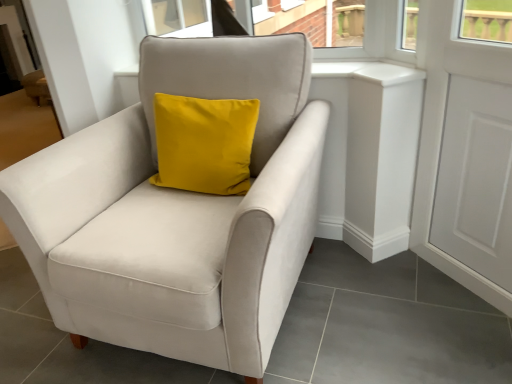
Question: From the image's perspective, is suede-like beige armchair at center located above or below white matte door at right?

Choices:
 (A) below
 (B) above

Answer: (A)

Question: Is point (212, 211) positioned closer to the camera than point (444, 190)?

Choices:
 (A) closer
 (B) farther

Answer: (A)

Question: From a real-world perspective, is suede-like beige armchair at center above or below white matte door at right?

Choices:
 (A) above
 (B) below

Answer: (B)

Question: From the image's perspective, relative to suede-like beige armchair at center, is white matte door at right above or below?

Choices:
 (A) below
 (B) above

Answer: (B)

Question: From a real-world perspective, is white matte door at right above or below suede-like beige armchair at center?

Choices:
 (A) above
 (B) below

Answer: (A)

Question: Looking at the image, does white matte door at right seem bigger or smaller compared to suede-like beige armchair at center?

Choices:
 (A) big
 (B) small

Answer: (B)

Question: Is point (433, 127) positioned closer to the camera than point (175, 347)?

Choices:
 (A) farther
 (B) closer

Answer: (A)